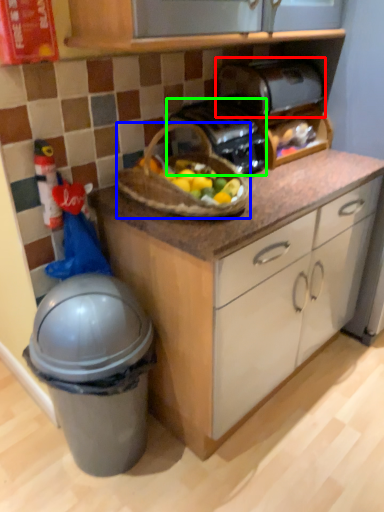
Question: Which object is the closest to the toaster (highlighted by a red box)? Choose among these: picnic basket (highlighted by a blue box) or toaster (highlighted by a green box).

Choices:
 (A) picnic basket
 (B) toaster

Answer: (B)